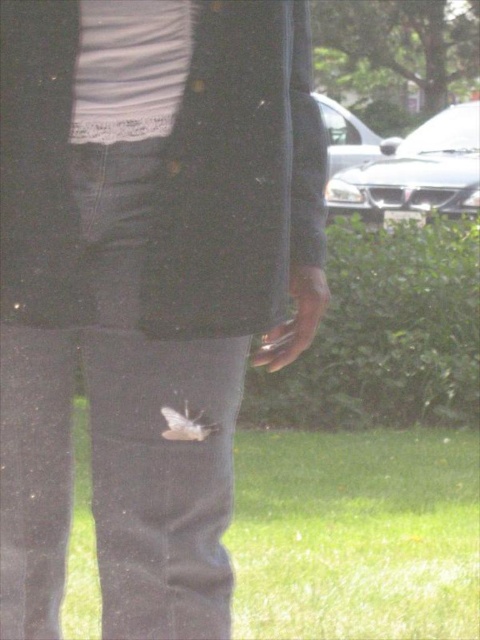
Question: Which point is farther to the camera?

Choices:
 (A) green grass at lower center
 (B) white matte bird at center

Answer: (A)

Question: Does dark gray jeans at center have a lesser width compared to smooth leather hand at center?

Choices:
 (A) yes
 (B) no

Answer: (B)

Question: Among these points, which one is farthest from the camera?

Choices:
 (A) (192, 438)
 (B) (291, 353)
 (C) (460, 477)

Answer: (C)

Question: Is dark gray jeans at center below smooth leather hand at center?

Choices:
 (A) yes
 (B) no

Answer: (B)

Question: Is dark gray jeans at center smaller than smooth leather hand at center?

Choices:
 (A) no
 (B) yes

Answer: (A)

Question: Among these points, which one is farthest from the camera?

Choices:
 (A) (49, 252)
 (B) (309, 632)
 (C) (179, 435)
 (D) (301, 301)

Answer: (B)